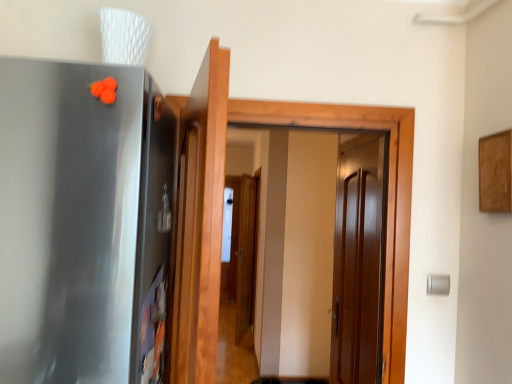
Question: Considering the relative sizes of wooden door at center, acting as the 2th door starting from the right, and glossy wood door at center, arranged as the second door when viewed from the left, in the image provided, is wooden door at center, acting as the 2th door starting from the right, wider than glossy wood door at center, arranged as the second door when viewed from the left,?

Choices:
 (A) no
 (B) yes

Answer: (B)

Question: Does wooden door at center, the first door from the front, have a greater height compared to glossy wood door at center, the first door when ordered from right to left?

Choices:
 (A) no
 (B) yes

Answer: (A)

Question: From a real-world perspective, is wooden door at center, which ranks as the 2th door in back-to-front order, over glossy wood door at center, arranged as the second door when viewed from the left?

Choices:
 (A) no
 (B) yes

Answer: (B)

Question: Does wooden door at center, the first door from the front, have a larger size compared to glossy wood door at center, the 2th door from the front?

Choices:
 (A) yes
 (B) no

Answer: (A)

Question: Is wooden door at center, the first door from the front, surrounding glossy wood door at center, arranged as the second door when viewed from the left?

Choices:
 (A) no
 (B) yes

Answer: (A)

Question: Is wooden door at center, positioned as the 1th door in left-to-right order, taller or shorter than glossy wood door at center, the 2th door from the front?

Choices:
 (A) short
 (B) tall

Answer: (A)

Question: Looking at their shapes, would you say wooden door at center, positioned as the 1th door in left-to-right order, is wider or thinner than glossy wood door at center, arranged as the first door when viewed from the back?

Choices:
 (A) wide
 (B) thin

Answer: (A)

Question: From a real-world perspective, relative to glossy wood door at center, arranged as the second door when viewed from the left, is wooden door at center, acting as the 2th door starting from the right, vertically above or below?

Choices:
 (A) above
 (B) below

Answer: (A)

Question: From the image's perspective, relative to glossy wood door at center, arranged as the first door when viewed from the back, is wooden door at center, positioned as the 1th door in left-to-right order, above or below?

Choices:
 (A) above
 (B) below

Answer: (A)

Question: Relative to satin metallic refrigerator at left, is glossy wood door at center, arranged as the first door when viewed from the back, in front or behind?

Choices:
 (A) front
 (B) behind

Answer: (B)

Question: From the image's perspective, is glossy wood door at center, the first door when ordered from right to left, above or below satin metallic refrigerator at left?

Choices:
 (A) below
 (B) above

Answer: (A)

Question: Based on their positions, is glossy wood door at center, arranged as the first door when viewed from the back, located to the left or right of satin metallic refrigerator at left?

Choices:
 (A) right
 (B) left

Answer: (A)

Question: Is point (375, 314) closer or farther from the camera than point (102, 87)?

Choices:
 (A) closer
 (B) farther

Answer: (B)

Question: Considering the relative positions of glossy wood door at center, arranged as the first door when viewed from the back, and wooden door at center, positioned as the 1th door in left-to-right order, in the image provided, is glossy wood door at center, arranged as the first door when viewed from the back, to the left or to the right of wooden door at center, positioned as the 1th door in left-to-right order,?

Choices:
 (A) right
 (B) left

Answer: (A)

Question: From a real-world perspective, is glossy wood door at center, the 2th door from the front, above or below wooden door at center, the first door from the front?

Choices:
 (A) above
 (B) below

Answer: (B)